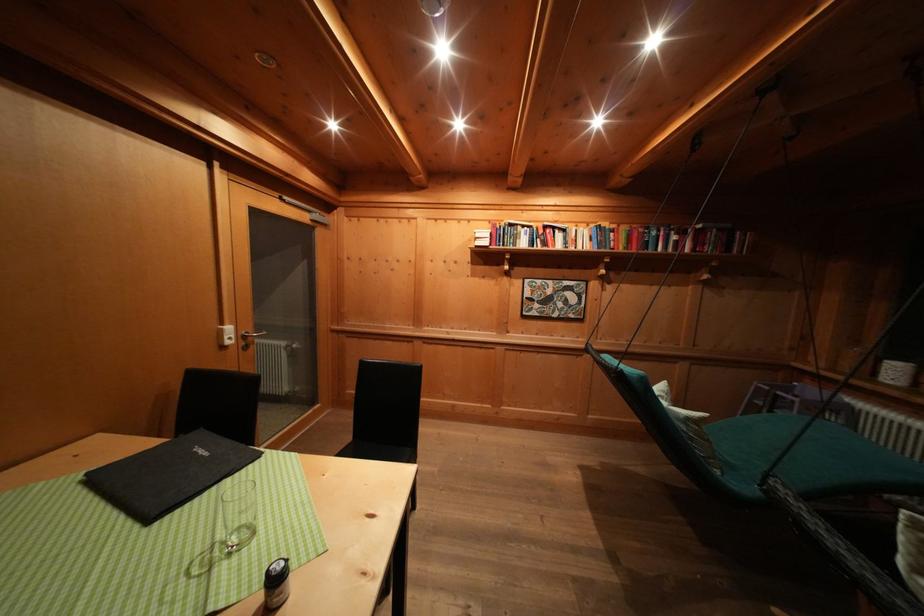
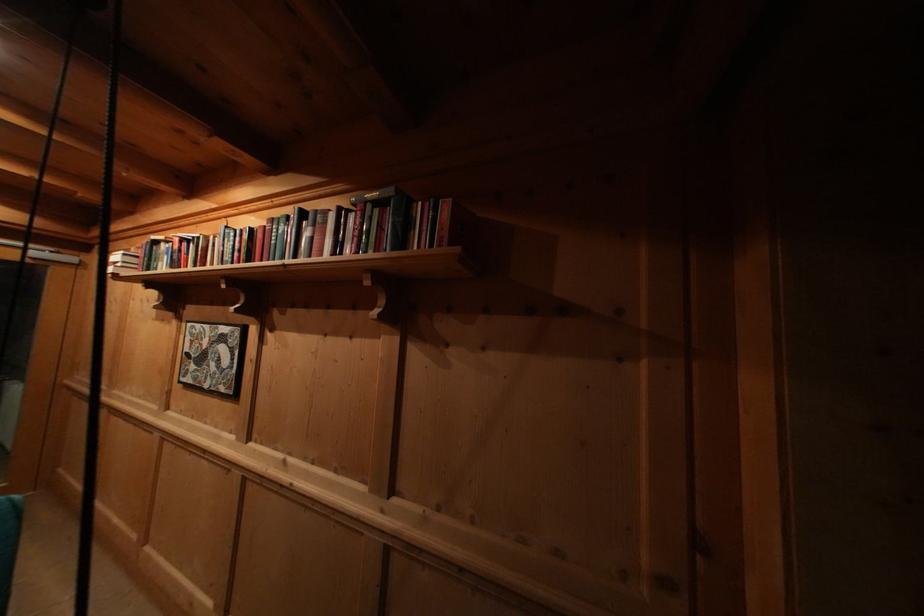
Where in the second image is the point corresponding to the point at 618,238 from the first image?

(244, 245)